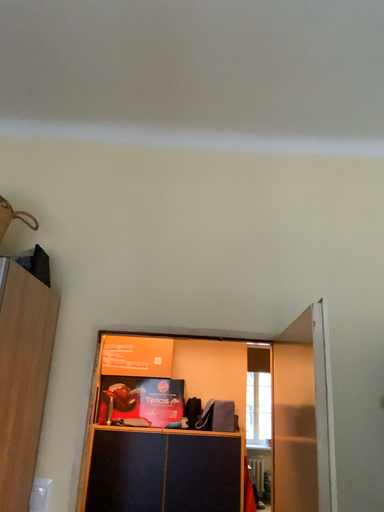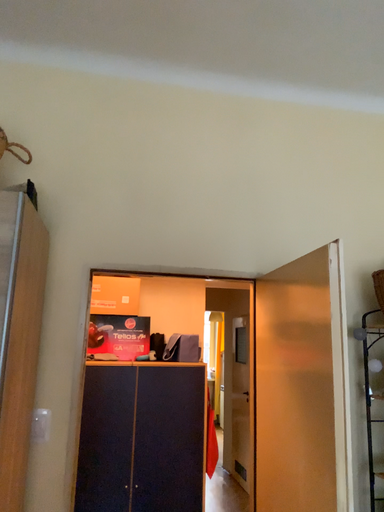
Question: How did the camera likely rotate when shooting the video?

Choices:
 (A) rotated left
 (B) rotated right

Answer: (B)